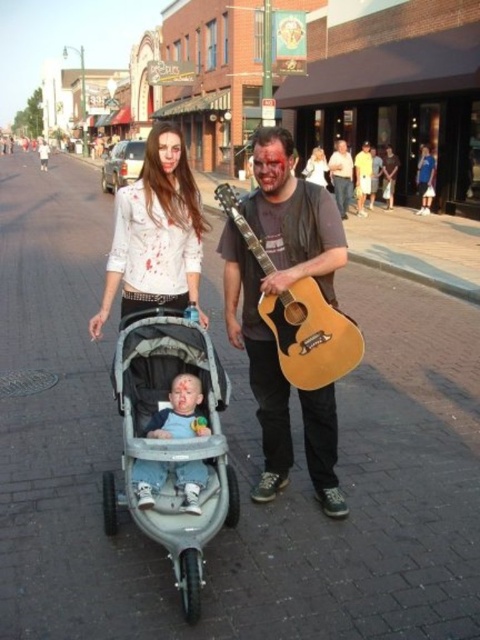
In the scene shown: Does light brown acoustic guitar at center have a greater height compared to light brown leather jacket at upper center?

In fact, light brown acoustic guitar at center may be shorter than light brown leather jacket at upper center.

Does light brown acoustic guitar at center appear under light brown leather jacket at upper center?

Indeed, light brown acoustic guitar at center is positioned under light brown leather jacket at upper center.

Which is behind, point (249, 236) or point (346, 196)?

Positioned behind is point (346, 196).

The width and height of the screenshot is (480, 640). Identify the location of light brown acoustic guitar at center. (312, 337).

Is point (156, 147) farther from viewer compared to point (338, 170)?

That is False.

Can you confirm if white matte shirt at center is positioned to the left of light brown leather jacket at upper center?

Indeed, white matte shirt at center is positioned on the left side of light brown leather jacket at upper center.

Describe the element at coordinates (156, 234) in the screenshot. The height and width of the screenshot is (640, 480). I see `white matte shirt at center` at that location.

Where is `white matte shirt at center`? The height and width of the screenshot is (640, 480). white matte shirt at center is located at coordinates (156, 234).

How much distance is there between light blue denim pants at center and matte yellow shirt at center?

A distance of 15.63 meters exists between light blue denim pants at center and matte yellow shirt at center.

Is point (183, 508) positioned after point (361, 195)?

That is False.

Is point (177, 401) positioned after point (357, 164)?

No, (177, 401) is closer to viewer.

Locate an element on the screen. light blue denim pants at center is located at coordinates click(180, 412).